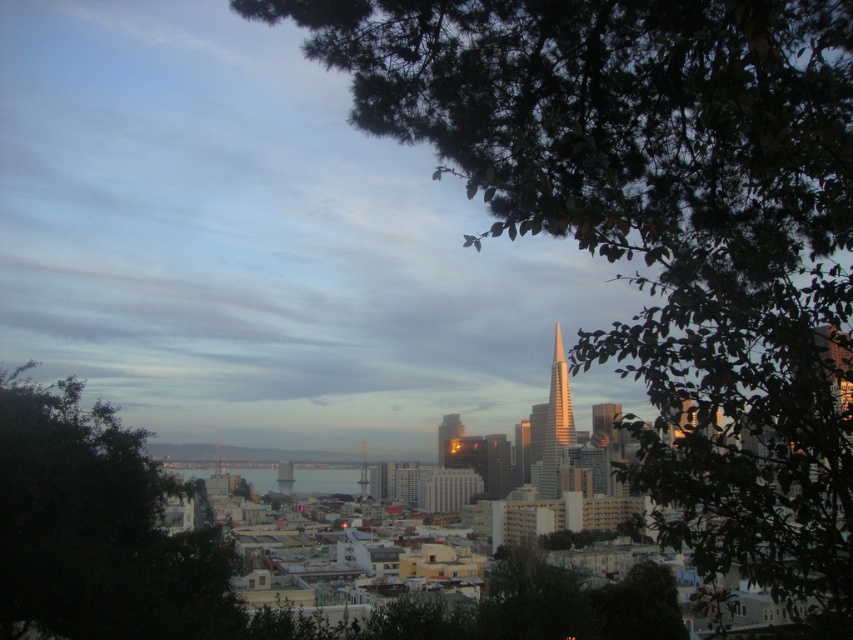
Question: Which point is farther from the camera taking this photo?

Choices:
 (A) (439, 460)
 (B) (761, 323)
 (C) (364, 492)
 (D) (535, 474)

Answer: (D)

Question: Can you confirm if green leafy tree at upper right is positioned to the right of golden reflective skyscraper at center?

Choices:
 (A) no
 (B) yes

Answer: (B)

Question: Which point is farther to the camera?

Choices:
 (A) (456, 436)
 (B) (821, 493)

Answer: (A)

Question: Does green leafy tree at left appear on the right side of golden glass skyscraper at center?

Choices:
 (A) yes
 (B) no

Answer: (B)

Question: Where is green leafy tree at left located in relation to golden reflective skyscraper at center in the image?

Choices:
 (A) above
 (B) below

Answer: (B)

Question: Among these points, which one is nearest to the camera?

Choices:
 (A) click(553, 458)
 (B) click(363, 467)
 (C) click(804, 202)
 (D) click(193, 541)

Answer: (C)